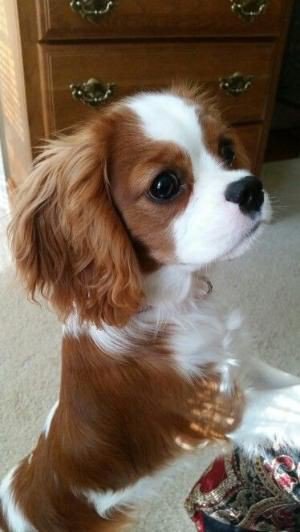
At what (x,y) coordinates should I click in order to perform the action: click on grey carpet. Please return your answer as a coordinate pair (x, y). Image resolution: width=300 pixels, height=532 pixels. Looking at the image, I should click on (156, 501), (281, 338), (23, 342), (22, 423), (288, 182), (271, 276).